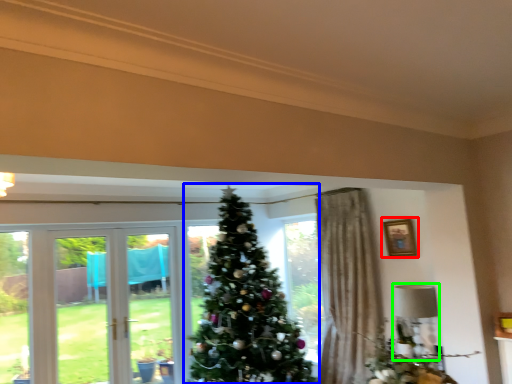
Question: Which object is positioned farthest from picture frame (highlighted by a red box)? Select from christmas tree (highlighted by a blue box) and lamp (highlighted by a green box).

Choices:
 (A) christmas tree
 (B) lamp

Answer: (A)